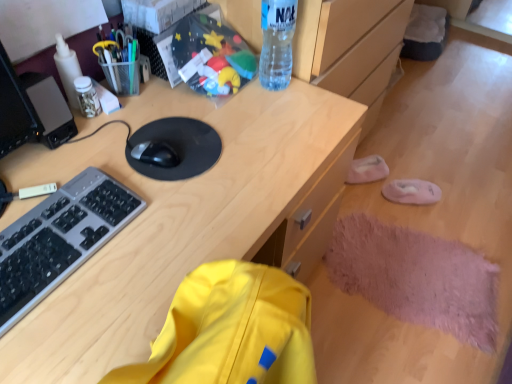
This screenshot has height=384, width=512. Identify the location of free space to the left of transparent plastic bottle at upper center, positioned as the first bottle in right-to-left order. (223, 95).